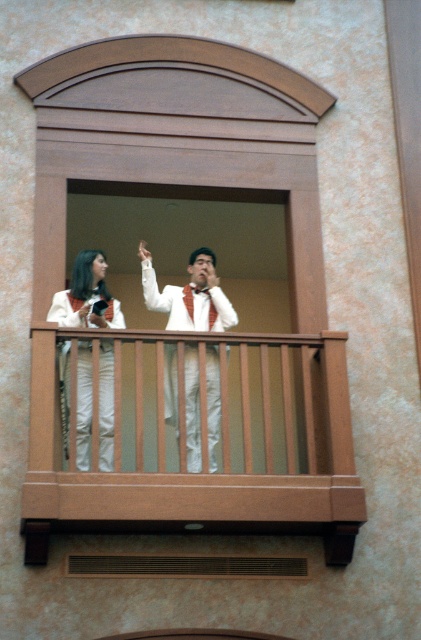
Question: Is brown wooden balcony at center bigger than white matte pants at center?

Choices:
 (A) yes
 (B) no

Answer: (A)

Question: Is brown wooden balcony at center below brown wooden balustrade at center?

Choices:
 (A) no
 (B) yes

Answer: (A)

Question: Estimate the real-world distances between objects in this image. Which object is closer to the brown wooden balcony at center?

Choices:
 (A) brown wooden balustrade at center
 (B) white satin suit at center
 (C) white matte pants at center

Answer: (A)

Question: Which point appears farthest from the camera in this image?

Choices:
 (A) (210, 364)
 (B) (93, 88)

Answer: (B)

Question: Which of the following is the closest to the observer?

Choices:
 (A) click(196, 348)
 (B) click(335, 376)

Answer: (B)

Question: Does brown wooden balcony at center have a larger size compared to white satin suit at center?

Choices:
 (A) no
 (B) yes

Answer: (B)